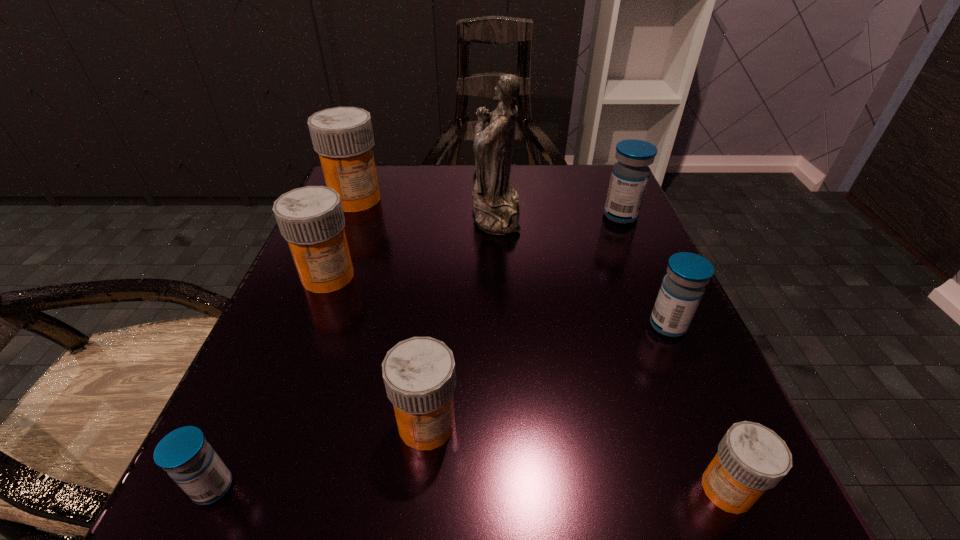
Select which orange medicine is the third closest to the fifth farthest object. Please provide its 2D coordinates. Your answer should be formatted as a tuple, i.e. [(x, y)], where the tuple contains the x and y coordinates of a point satisfying the conditions above.

[(311, 219)]

Locate an element on the screen. This screenshot has height=540, width=960. orange medicine object that ranks as the closest to the fourth object from right to left is located at coordinates (343, 137).

At what (x,y) coordinates should I click in order to perform the action: click on the third closest blue medicine relative to the third nearest orange medicine. Please return your answer as a coordinate pair (x, y). Looking at the image, I should click on (630, 175).

Locate which blue medicine is the second closest to the third orange medicine from left to right. Please provide its 2D coordinates. Your answer should be formatted as a tuple, i.e. [(x, y)], where the tuple contains the x and y coordinates of a point satisfying the conditions above.

[(682, 288)]

At what (x,y) coordinates should I click in order to perform the action: click on free spot that satisfies the following two spatial constraints: 1. on the front-facing side of the fourth object from right to left; 2. on the label side of the third farthest medicine. Please return your answer as a coordinate pair (x, y). Looking at the image, I should click on (499, 276).

Find the location of a particular element. The width and height of the screenshot is (960, 540). vacant area that satisfies the following two spatial constraints: 1. on the back side of the smallest blue medicine; 2. on the right side of the second biggest blue medicine is located at coordinates (286, 325).

This screenshot has height=540, width=960. Find the location of `free point that satisfies the following two spatial constraints: 1. on the front-facing side of the fifth object from left to right; 2. on the label side of the sixth farthest object`. free point that satisfies the following two spatial constraints: 1. on the front-facing side of the fifth object from left to right; 2. on the label side of the sixth farthest object is located at coordinates (506, 424).

Locate an element on the screen. The width and height of the screenshot is (960, 540). vacant space that satisfies the following two spatial constraints: 1. on the front-facing side of the figurine; 2. on the back side of the second biggest blue medicine is located at coordinates (501, 325).